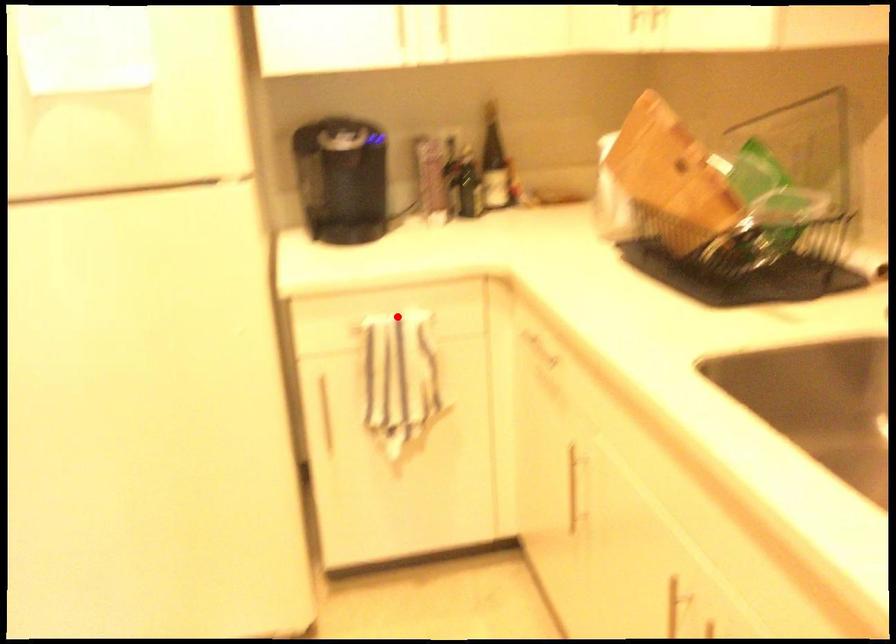
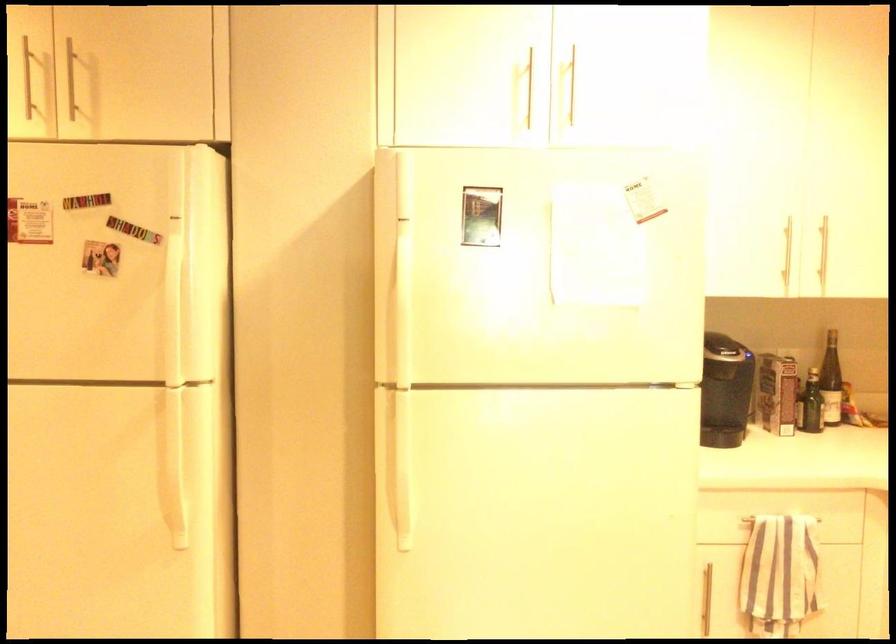
Find the pixel in the second image that matches the highlighted location in the first image.

(781, 518)